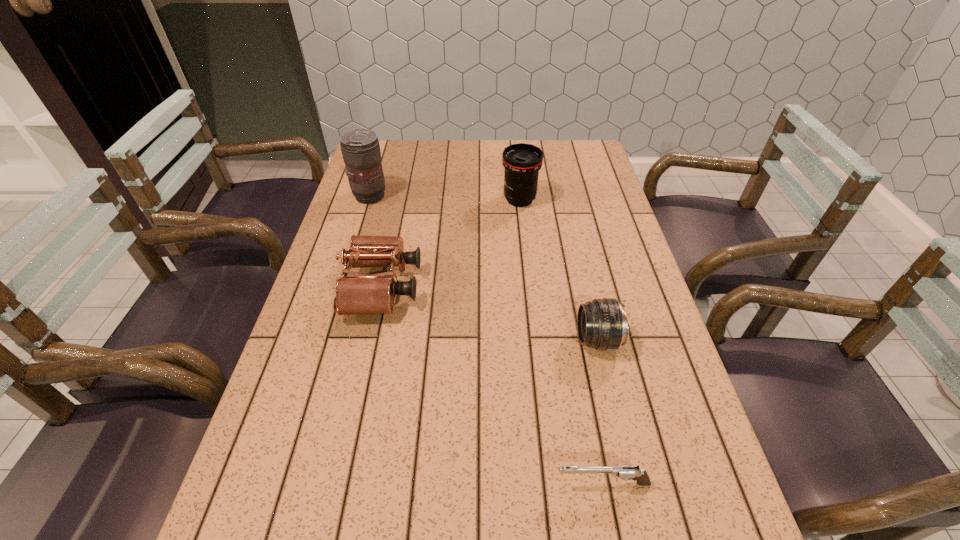
The image size is (960, 540). In order to click on free space located on the left of the second telephoto lens from right to left in this screenshot , I will do `click(410, 200)`.

I want to click on free space located through the eyepieces of the binoculars, so click(x=512, y=287).

The height and width of the screenshot is (540, 960). Identify the location of vacant space located 0.180m at the front element of the nearest telephoto lens. (500, 340).

Locate an element on the screen. free space located 0.130m at the front element of the nearest telephoto lens is located at coordinates (521, 340).

Image resolution: width=960 pixels, height=540 pixels. Find the location of `vacant space located 0.160m at the front element of the nearest telephoto lens`. vacant space located 0.160m at the front element of the nearest telephoto lens is located at coordinates coord(509,340).

Locate an element on the screen. vacant area situated 0.110m on the front-facing side of the shortest object is located at coordinates (494, 483).

Locate an element on the screen. Image resolution: width=960 pixels, height=540 pixels. vacant point located on the front-facing side of the shortest object is located at coordinates (450, 483).

Find the location of a particular element. The height and width of the screenshot is (540, 960). free spot located on the front-facing side of the shortest object is located at coordinates (389, 483).

Where is `telephoto lens that is positioned at the left edge`? The width and height of the screenshot is (960, 540). telephoto lens that is positioned at the left edge is located at coordinates (360, 148).

Where is `binoculars at the left edge`? The height and width of the screenshot is (540, 960). binoculars at the left edge is located at coordinates click(361, 294).